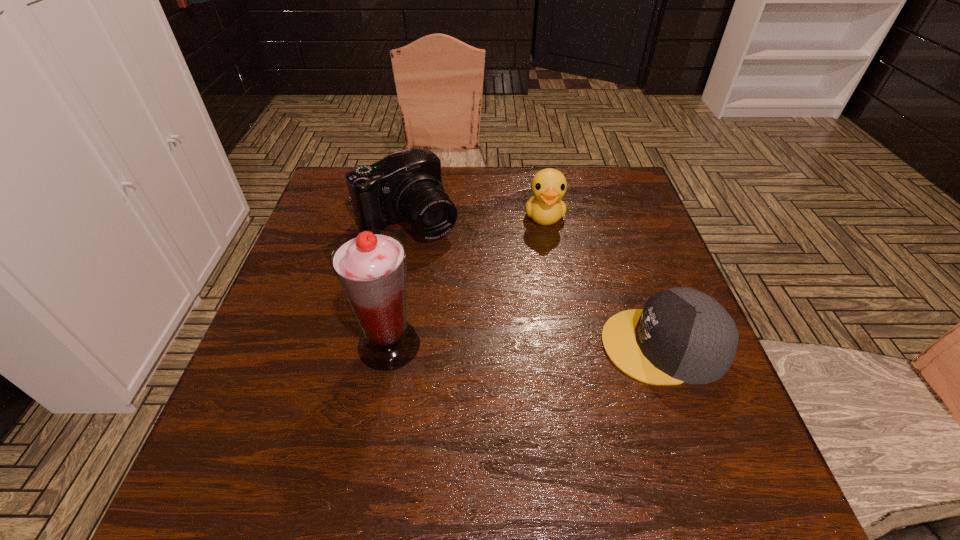
You are a GUI agent. You are given a task and a screenshot of the screen. Output one action in this format:
    pyautogui.click(x=<x>, y=<y>)
    Task: Click on the object that is the third closest to the rightmost object
    The width and height of the screenshot is (960, 540).
    Given the screenshot: What is the action you would take?
    pyautogui.click(x=370, y=266)

Where is `blank space that satisfies the following two spatial constraints: 1. on the front side of the smoothie; 2. on the left side of the camera`? The height and width of the screenshot is (540, 960). blank space that satisfies the following two spatial constraints: 1. on the front side of the smoothie; 2. on the left side of the camera is located at coordinates [385, 345].

Locate an element on the screen. free space that satisfies the following two spatial constraints: 1. on the front side of the cap; 2. on the front-facing side of the smoothie is located at coordinates (389, 345).

This screenshot has width=960, height=540. What are the coordinates of `free region that satisfies the following two spatial constraints: 1. on the back side of the third object from left to right; 2. on the left side of the tallest object` in the screenshot? It's located at (412, 217).

Identify the location of vacant space that satisfies the following two spatial constraints: 1. on the front side of the tallest object; 2. on the right side of the camera. Image resolution: width=960 pixels, height=540 pixels. (385, 345).

I want to click on free location that satisfies the following two spatial constraints: 1. on the back side of the second object from right to left; 2. on the left side of the smoothie, so click(412, 217).

The height and width of the screenshot is (540, 960). In order to click on free region that satisfies the following two spatial constraints: 1. on the front side of the duck; 2. on the front-facing side of the cap in this screenshot , I will do `click(566, 345)`.

Find the location of a particular element. Image resolution: width=960 pixels, height=540 pixels. vacant point that satisfies the following two spatial constraints: 1. on the front side of the camera; 2. on the front-facing side of the rightmost object is located at coordinates (385, 345).